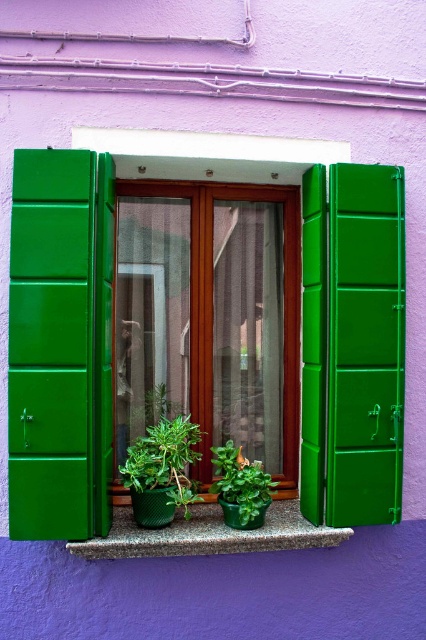
You are a gardener who wants to ensure proper sunlight for the green matte plant at center and the green matte pot at center. Since both are on the windowsill, which one requires more vertical space to accommodate its height?

The green matte plant at center requires more vertical space because it is much taller than the green matte pot at center.

You are standing in front of the window and want to touch both points marked on the window glass. Which point, point (66, 544) or point (138, 468), will require you to reach out further from your current position?

Point (138, 468) will require you to reach out further because it is farther from the camera compared to point (66, 544).

You are a window cleaner standing at the center of the room. You need to clean the window but must avoid the green matte plant at center. Can you reach the window without moving the plant?

The green matte plant at center is located at point (161, 472), so yes, you can reach the window without moving the plant as it is positioned away from the center of the room.